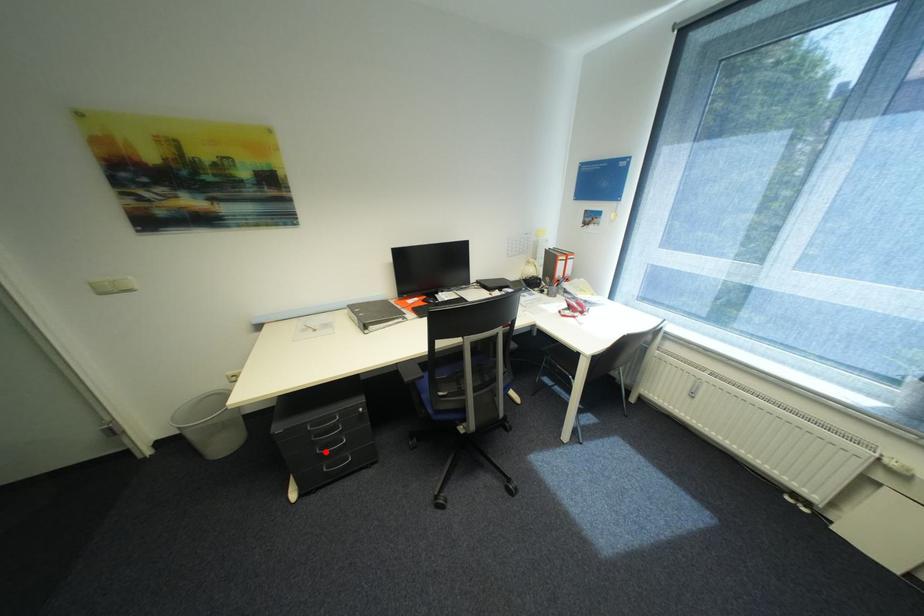
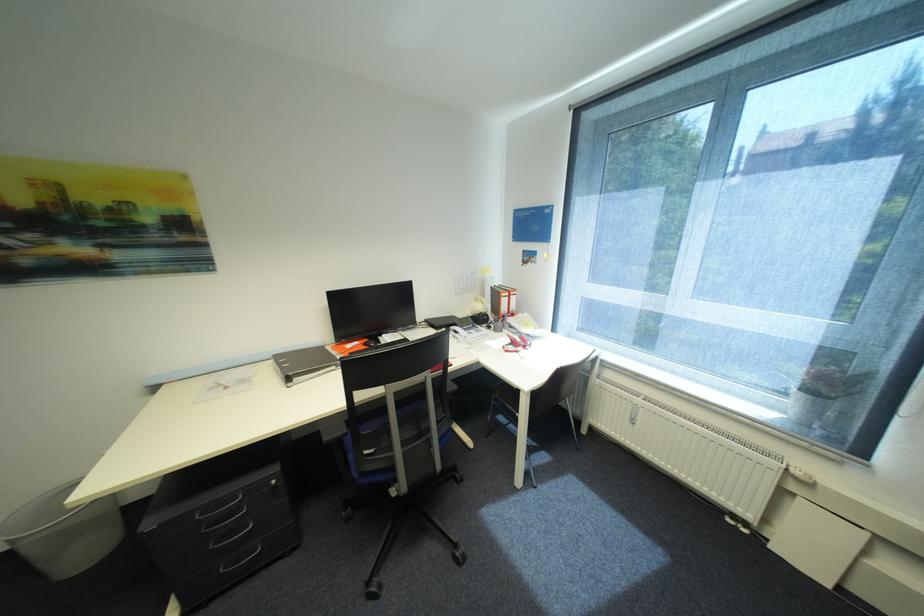
Question: I am providing you with two images of the same scene from different viewpoints. In image1, a red point is highlighted. Considering the same 3D point in image2, which of the following is correct?

Choices:
 (A) It is closer
 (B) It is farther

Answer: (A)